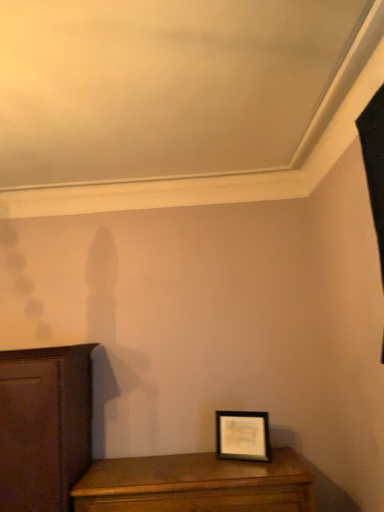
Question: Should I look upward or downward to see black matte picture frame at lower right?

Choices:
 (A) down
 (B) up

Answer: (A)